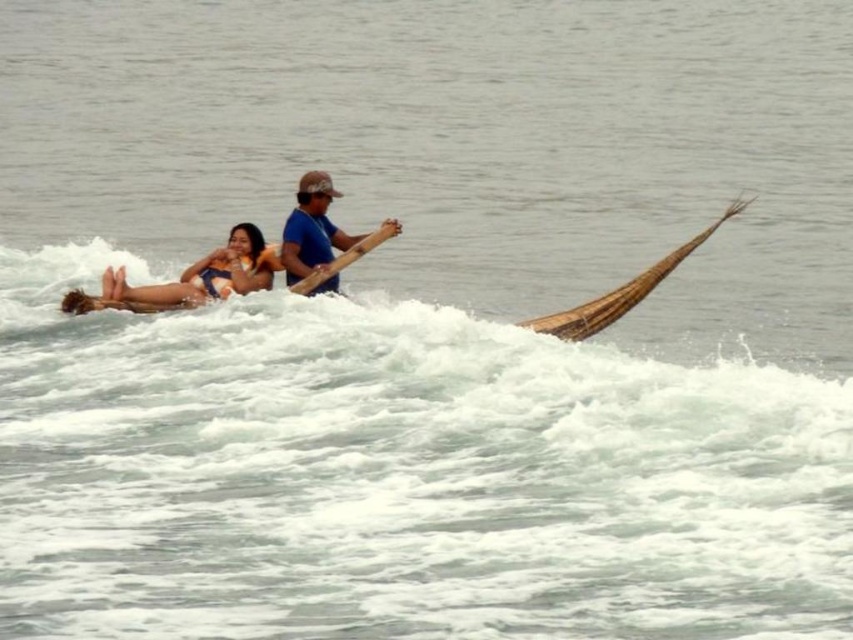
Describe the element at coordinates (189, 278) in the screenshot. This screenshot has height=640, width=853. I see `orange bikini top at left` at that location.

Which is behind, point (263, 248) or point (320, 257)?

Positioned behind is point (263, 248).

In order to click on orange bikini top at left in this screenshot , I will do `click(189, 278)`.

Can you confirm if orange bikini at center is positioned below brown woven canoe at right?

Incorrect, orange bikini at center is not positioned below brown woven canoe at right.

Between orange bikini at center and brown woven canoe at right, which one has less height?

Standing shorter between the two is brown woven canoe at right.

Does point (173, 285) come farther from viewer compared to point (550, 321)?

Yes, point (173, 285) is behind point (550, 321).

The image size is (853, 640). I want to click on orange bikini at center, so click(248, 260).

Can you confirm if orange bikini at center is positioned to the right of orange bikini top at left?

Indeed, orange bikini at center is positioned on the right side of orange bikini top at left.

This screenshot has height=640, width=853. I want to click on orange bikini at center, so click(248, 260).